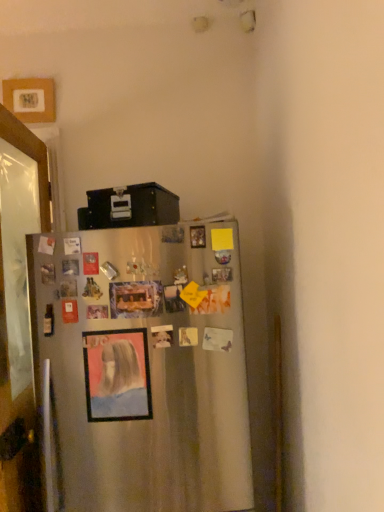
What is the approximate height of satin silver fridge at center?

28.22 inches.

Where is `satin silver fridge at center`? This screenshot has height=512, width=384. satin silver fridge at center is located at coordinates (144, 366).

What's the angular difference between satin silver fridge at center and matte plastic picture frame at center, positioned as the 1th picture frame in front-to-back order,'s facing directions?

They differ by 0.688 degrees in their facing directions.

Looking at this image, between satin silver fridge at center and matte plastic picture frame at center, marked as the second picture frame in a left-to-right arrangement, which one has less height?

Standing shorter between the two is matte plastic picture frame at center, marked as the second picture frame in a left-to-right arrangement.

Is satin silver fridge at center further to camera compared to matte plastic picture frame at center, the 1th picture frame positioned from the bottom?

No, it is not.

The image size is (384, 512). I want to click on refrigerator on the right side of wooden picture frame at upper left, which is the second picture frame in front-to-back order, so click(144, 366).

What's the angular difference between satin silver fridge at center and wooden picture frame at upper left, marked as the first picture frame in a top-to-bottom arrangement,'s facing directions?

The angular difference between satin silver fridge at center and wooden picture frame at upper left, marked as the first picture frame in a top-to-bottom arrangement, is 4.12 degrees.

From the picture: Is satin silver fridge at center looking in the opposite direction of wooden picture frame at upper left, arranged as the 1th picture frame when viewed from the back?

No, wooden picture frame at upper left, arranged as the 1th picture frame when viewed from the back, is not at the back of satin silver fridge at center.

In the scene shown: Is satin silver fridge at center not near wooden picture frame at upper left, marked as the 1th picture frame in a left-to-right arrangement?

Absolutely, satin silver fridge at center is distant from wooden picture frame at upper left, marked as the 1th picture frame in a left-to-right arrangement.

Considering the relative positions of matte plastic picture frame at center, which ranks as the second picture frame in top-to-bottom order, and wooden picture frame at upper left, the second picture frame in the bottom-to-top sequence, in the image provided, is matte plastic picture frame at center, which ranks as the second picture frame in top-to-bottom order, to the left or to the right of wooden picture frame at upper left, the second picture frame in the bottom-to-top sequence,?

In the image, matte plastic picture frame at center, which ranks as the second picture frame in top-to-bottom order, appears on the right side of wooden picture frame at upper left, the second picture frame in the bottom-to-top sequence.

How many degrees apart are the facing directions of matte plastic picture frame at center, positioned as the 1th picture frame in front-to-back order, and wooden picture frame at upper left, the second picture frame in the bottom-to-top sequence?

The facing directions of matte plastic picture frame at center, positioned as the 1th picture frame in front-to-back order, and wooden picture frame at upper left, the second picture frame in the bottom-to-top sequence, are 3.43 degrees apart.

Is matte plastic picture frame at center, arranged as the 2th picture frame when viewed from the back, thinner than wooden picture frame at upper left, the second picture frame positioned from the right?

Yes.

Considering the sizes of matte plastic picture frame at center, arranged as the 2th picture frame when viewed from the back, and wooden picture frame at upper left, which is the second picture frame in front-to-back order, in the image, is matte plastic picture frame at center, arranged as the 2th picture frame when viewed from the back, bigger or smaller than wooden picture frame at upper left, which is the second picture frame in front-to-back order,?

Considering their sizes, matte plastic picture frame at center, arranged as the 2th picture frame when viewed from the back, takes up less space than wooden picture frame at upper left, which is the second picture frame in front-to-back order.

Consider the image. Is matte plastic picture frame at center, the 1th picture frame positioned from the bottom, spatially inside satin silver fridge at center, or outside of it?

The correct answer is: inside.

In the scene shown: From a real-world perspective, who is located lower, matte plastic picture frame at center, which ranks as the second picture frame in top-to-bottom order, or satin silver fridge at center?

matte plastic picture frame at center, which ranks as the second picture frame in top-to-bottom order.

Between matte plastic picture frame at center, the 1th picture frame positioned from the bottom, and satin silver fridge at center, which one has less height?

matte plastic picture frame at center, the 1th picture frame positioned from the bottom, is shorter.

Looking at this image, between matte plastic picture frame at center, the 1th picture frame positioned from the bottom, and satin silver fridge at center, which one has smaller size?

Smaller between the two is matte plastic picture frame at center, the 1th picture frame positioned from the bottom.

How many degrees apart are the facing directions of wooden picture frame at upper left, the second picture frame positioned from the right, and matte plastic picture frame at center, arranged as the 2th picture frame when viewed from the back?

3.43 degrees.

Between wooden picture frame at upper left, which is the second picture frame in front-to-back order, and matte plastic picture frame at center, positioned as the 1th picture frame in front-to-back order, which one has larger size?

wooden picture frame at upper left, which is the second picture frame in front-to-back order, is bigger.

Locate an element on the screen. This screenshot has height=512, width=384. picture frame behind the matte plastic picture frame at center, arranged as the 2th picture frame when viewed from the back is located at coordinates click(30, 99).

Is the depth of wooden picture frame at upper left, which is the second picture frame in front-to-back order, greater than that of matte plastic picture frame at center, which ranks as the second picture frame in top-to-bottom order?

Yes, wooden picture frame at upper left, which is the second picture frame in front-to-back order, is behind matte plastic picture frame at center, which ranks as the second picture frame in top-to-bottom order.

Is wooden picture frame at upper left, the second picture frame positioned from the right, thinner than clear glass door at left?

Indeed, wooden picture frame at upper left, the second picture frame positioned from the right, has a lesser width compared to clear glass door at left.

From the image's perspective, is wooden picture frame at upper left, marked as the 1th picture frame in a left-to-right arrangement, under clear glass door at left?

Incorrect, from the image's perspective, wooden picture frame at upper left, marked as the 1th picture frame in a left-to-right arrangement, is higher than clear glass door at left.

The image size is (384, 512). Find the location of `glass door behind the wooden picture frame at upper left, the second picture frame positioned from the right`. glass door behind the wooden picture frame at upper left, the second picture frame positioned from the right is located at coordinates (19, 311).

From a real-world perspective, who is located higher, wooden picture frame at upper left, which is the second picture frame in front-to-back order, or clear glass door at left?

wooden picture frame at upper left, which is the second picture frame in front-to-back order, from a real-world perspective.

What's the angular difference between clear glass door at left and wooden picture frame at upper left, arranged as the 1th picture frame when viewed from the back,'s facing directions?

The angular difference between clear glass door at left and wooden picture frame at upper left, arranged as the 1th picture frame when viewed from the back, is 0.187 degrees.

Does clear glass door at left appear on the right side of wooden picture frame at upper left, the second picture frame in the bottom-to-top sequence?

In fact, clear glass door at left is to the left of wooden picture frame at upper left, the second picture frame in the bottom-to-top sequence.

Is clear glass door at left positioned behind wooden picture frame at upper left, the second picture frame positioned from the right?

Yes, it is.

Who is bigger, clear glass door at left or wooden picture frame at upper left, the second picture frame in the bottom-to-top sequence?

With larger size is clear glass door at left.

You are a GUI agent. You are given a task and a screenshot of the screen. Output one action in this format:
    pyautogui.click(x=<x>, y=<y>)
    Task: Click on the refrigerator on the right of matte plastic picture frame at center, the 1th picture frame positioned from the bottom
    The width and height of the screenshot is (384, 512).
    Given the screenshot: What is the action you would take?
    pyautogui.click(x=144, y=366)

Identify the location of picture frame above the satin silver fridge at center (from a real-world perspective). (30, 99).

Estimate the real-world distances between objects in this image. Which object is further from wooden picture frame at upper left, the second picture frame positioned from the right, clear glass door at left or satin silver fridge at center?

satin silver fridge at center lies further to wooden picture frame at upper left, the second picture frame positioned from the right, than the other object.

Looking at the image, which one is located closer to wooden picture frame at upper left, arranged as the 1th picture frame when viewed from the back, satin silver fridge at center or matte plastic picture frame at center, the 1th picture frame when ordered from right to left?

Among the two, satin silver fridge at center is located nearer to wooden picture frame at upper left, arranged as the 1th picture frame when viewed from the back.

Based on their spatial positions, is matte plastic picture frame at center, arranged as the 2th picture frame when viewed from the back, or clear glass door at left further from satin silver fridge at center?

The object further to satin silver fridge at center is clear glass door at left.

Looking at the image, which one is located further to wooden picture frame at upper left, arranged as the 1th picture frame when viewed from the back, clear glass door at left or matte plastic picture frame at center, arranged as the 2th picture frame when viewed from the back?

Based on the image, matte plastic picture frame at center, arranged as the 2th picture frame when viewed from the back, appears to be further to wooden picture frame at upper left, arranged as the 1th picture frame when viewed from the back.

Looking at the image, which one is located closer to satin silver fridge at center, clear glass door at left or matte plastic picture frame at center, positioned as the 1th picture frame in front-to-back order?

matte plastic picture frame at center, positioned as the 1th picture frame in front-to-back order, lies closer to satin silver fridge at center than the other object.

Estimate the real-world distances between objects in this image. Which object is further from matte plastic picture frame at center, marked as the second picture frame in a left-to-right arrangement, wooden picture frame at upper left, which is the second picture frame in front-to-back order, or clear glass door at left?

wooden picture frame at upper left, which is the second picture frame in front-to-back order.

Based on the photo, considering their positions, is satin silver fridge at center positioned closer to matte plastic picture frame at center, marked as the second picture frame in a left-to-right arrangement, than clear glass door at left?

satin silver fridge at center is positioned closer to the anchor matte plastic picture frame at center, marked as the second picture frame in a left-to-right arrangement.

Based on their spatial positions, is wooden picture frame at upper left, arranged as the 1th picture frame when viewed from the back, or matte plastic picture frame at center, arranged as the 2th picture frame when viewed from the back, closer to satin silver fridge at center?

matte plastic picture frame at center, arranged as the 2th picture frame when viewed from the back, is positioned closer to the anchor satin silver fridge at center.

This screenshot has height=512, width=384. I want to click on picture frame between wooden picture frame at upper left, marked as the 1th picture frame in a left-to-right arrangement, and clear glass door at left in the up-down direction, so click(x=117, y=375).

The height and width of the screenshot is (512, 384). In order to click on refrigerator between wooden picture frame at upper left, arranged as the 1th picture frame when viewed from the back, and clear glass door at left in the up-down direction in this screenshot , I will do `click(144, 366)`.

The height and width of the screenshot is (512, 384). I want to click on refrigerator between wooden picture frame at upper left, marked as the first picture frame in a top-to-bottom arrangement, and matte plastic picture frame at center, marked as the second picture frame in a left-to-right arrangement, in the vertical direction, so click(x=144, y=366).